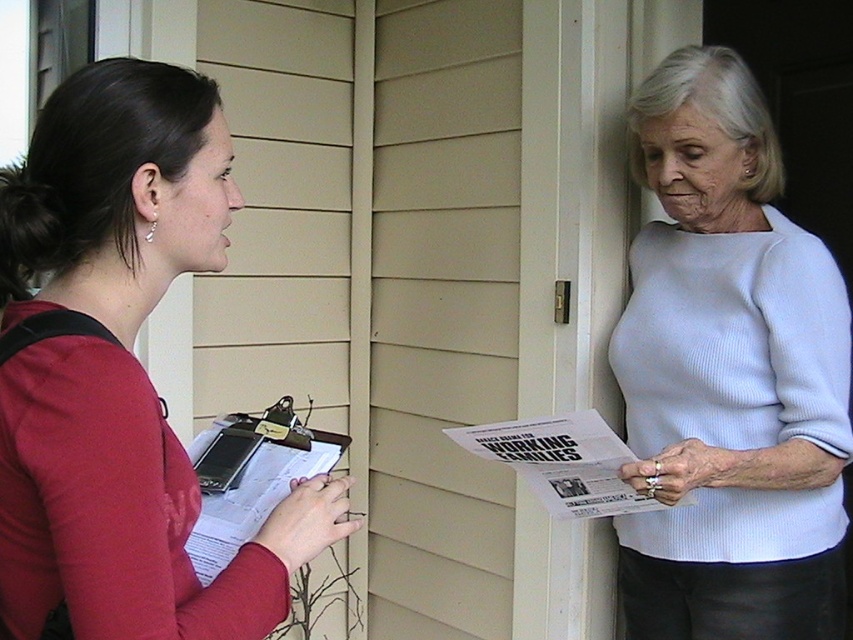
Where is `light blue ribbed sweater at upper right`? This screenshot has width=853, height=640. light blue ribbed sweater at upper right is located at coordinates (728, 376).

Does point (723, 157) come behind point (497, 440)?

Yes, point (723, 157) is farther from viewer.

Where is `light blue ribbed sweater at upper right`? The image size is (853, 640). light blue ribbed sweater at upper right is located at coordinates (728, 376).

Between point (129, 196) and point (743, 164), which one is positioned in front?

Point (129, 196) is more forward.

Is matte red shirt at left taller than light blue ribbed sweater at upper right?

No, matte red shirt at left is not taller than light blue ribbed sweater at upper right.

Who is more distant from viewer, (x=173, y=212) or (x=643, y=230)?

The point (x=643, y=230) is behind.

In order to click on matte red shirt at left in this screenshot , I will do `click(120, 372)`.

Is matte red shirt at left bigger than white glossy paper at center?

Indeed, matte red shirt at left has a larger size compared to white glossy paper at center.

Based on the photo, which of these two, matte red shirt at left or white glossy paper at center, stands shorter?

Standing shorter between the two is white glossy paper at center.

The image size is (853, 640). Identify the location of matte red shirt at left. (120, 372).

Identify the location of matte red shirt at left. 120,372.